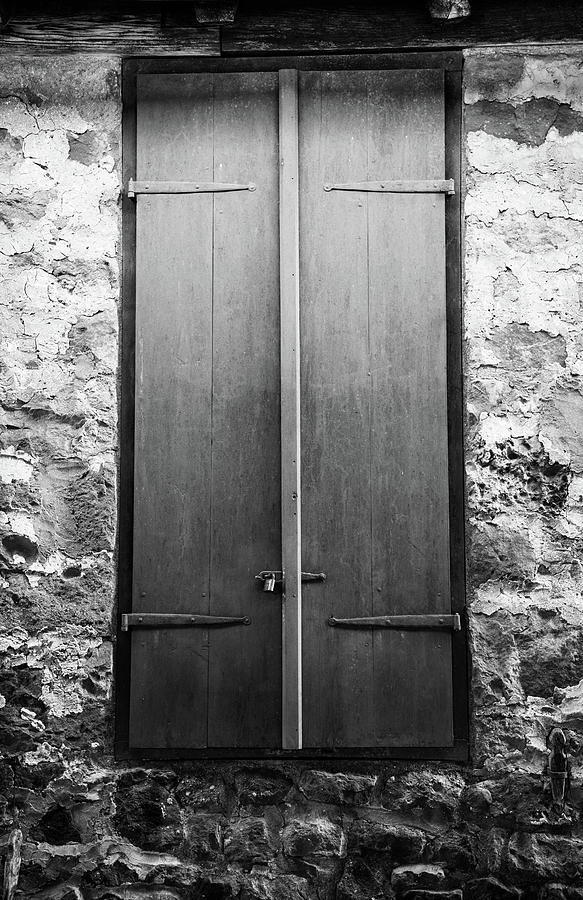
At what (x,y) coordinates should I click in order to perform the action: click on wooden doors. Please return your answer as a coordinate pair (x, y). Image resolution: width=583 pixels, height=900 pixels. Looking at the image, I should click on (210, 433), (372, 561).